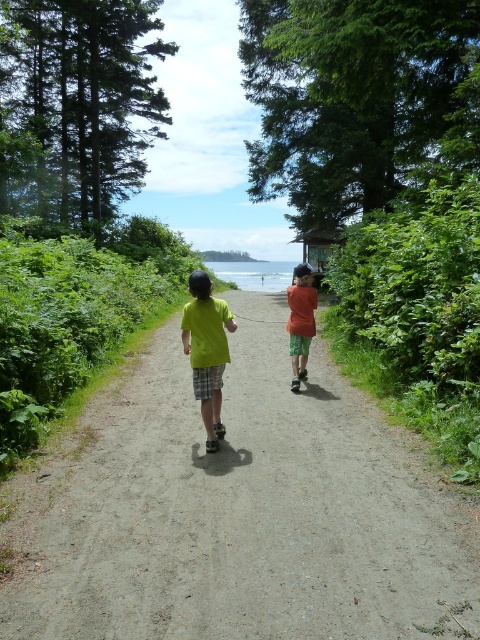
Which is more to the left, dirt path at center or neon green t-shirt at center?

From the viewer's perspective, neon green t-shirt at center appears more on the left side.

Image resolution: width=480 pixels, height=640 pixels. Identify the location of dirt path at center. (241, 513).

Does neon green t-shirt at center appear on the right side of orange cotton shirt at center?

Incorrect, neon green t-shirt at center is not on the right side of orange cotton shirt at center.

Can you confirm if neon green t-shirt at center is taller than orange cotton shirt at center?

No, neon green t-shirt at center is not taller than orange cotton shirt at center.

Does point (236, 326) lie behind point (310, 342)?

No, (236, 326) is in front of (310, 342).

Locate an element on the screen. This screenshot has height=640, width=480. neon green t-shirt at center is located at coordinates (206, 349).

Is dirt path at center to the left of orange cotton shirt at center from the viewer's perspective?

Yes, dirt path at center is to the left of orange cotton shirt at center.

Is dirt path at center positioned before orange cotton shirt at center?

Yes.

Is point (407, 538) more distant than point (300, 278)?

No, it is in front of (300, 278).

Identify the location of dirt path at center. The image size is (480, 640). (241, 513).